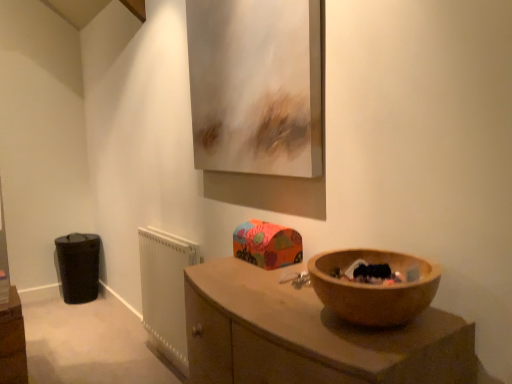
Question: From a real-world perspective, is white plastic radiator at lower left positioned under wooden at lower right based on gravity?

Choices:
 (A) no
 (B) yes

Answer: (B)

Question: Is white plastic radiator at lower left oriented towards wooden at lower right?

Choices:
 (A) yes
 (B) no

Answer: (B)

Question: From the image's perspective, is white plastic radiator at lower left beneath wooden at lower right?

Choices:
 (A) yes
 (B) no

Answer: (A)

Question: Considering the relative positions of white plastic radiator at lower left and wooden at lower right in the image provided, is white plastic radiator at lower left behind wooden at lower right?

Choices:
 (A) yes
 (B) no

Answer: (A)

Question: Does white plastic radiator at lower left have a larger size compared to wooden at lower right?

Choices:
 (A) no
 (B) yes

Answer: (A)

Question: Is wooden at lower right inside or outside of black fabric bag at lower left?

Choices:
 (A) inside
 (B) outside

Answer: (B)

Question: From a real-world perspective, is wooden at lower right above or below black fabric bag at lower left?

Choices:
 (A) below
 (B) above

Answer: (B)

Question: In terms of width, does wooden at lower right look wider or thinner when compared to black fabric bag at lower left?

Choices:
 (A) thin
 (B) wide

Answer: (B)

Question: Considering the positions of point (257, 312) and point (71, 258), is point (257, 312) closer or farther from the camera than point (71, 258)?

Choices:
 (A) farther
 (B) closer

Answer: (B)

Question: Is metallic silver picture frame at upper center taller or shorter than wooden at lower right?

Choices:
 (A) short
 (B) tall

Answer: (B)

Question: From the image's perspective, is metallic silver picture frame at upper center positioned above or below wooden at lower right?

Choices:
 (A) below
 (B) above

Answer: (B)

Question: Relative to wooden at lower right, is metallic silver picture frame at upper center in front or behind?

Choices:
 (A) front
 (B) behind

Answer: (B)

Question: Which is correct: metallic silver picture frame at upper center is inside wooden at lower right, or outside of it?

Choices:
 (A) outside
 (B) inside

Answer: (A)

Question: Does point (159, 238) appear closer or farther from the camera than point (74, 266)?

Choices:
 (A) farther
 (B) closer

Answer: (B)

Question: From the image's perspective, is white plastic radiator at lower left positioned above or below black fabric bag at lower left?

Choices:
 (A) below
 (B) above

Answer: (B)